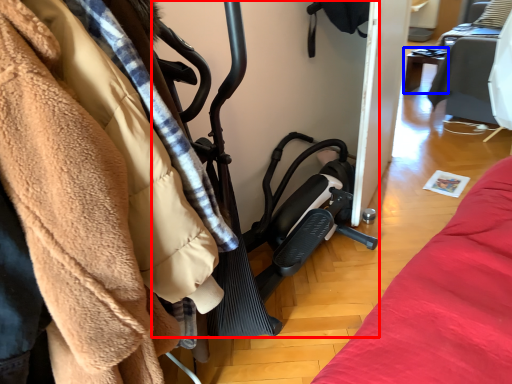
Question: Among these objects, which one is nearest to the camera, baby carriage (highlighted by a red box) or furniture (highlighted by a blue box)?

Choices:
 (A) baby carriage
 (B) furniture

Answer: (A)